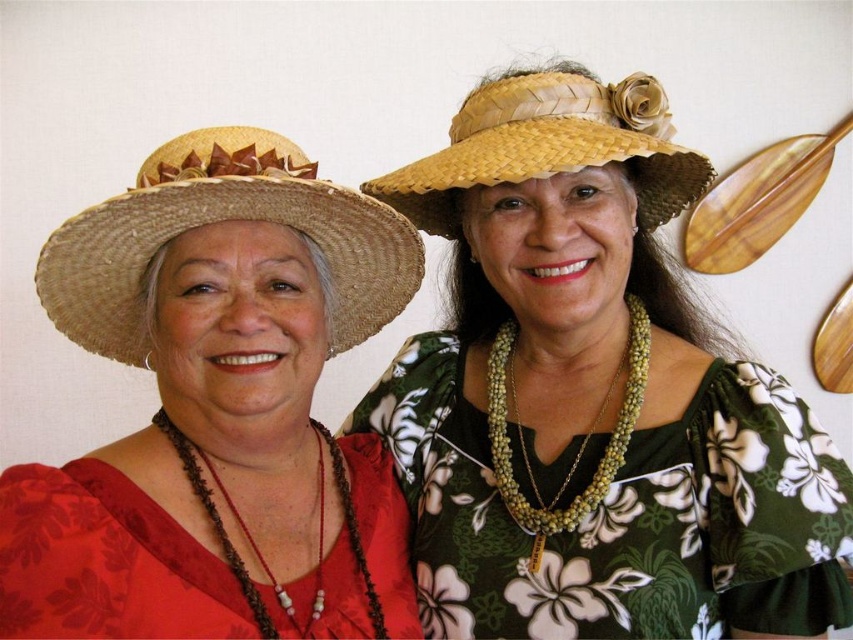
From the picture: You are an artist trying to paint the two women in the scene. You need to decide which hat to paint first based on their positions and sizes. Since the matte straw hat at upper left is taller than the straw woven hat at left, which hat should you start with to ensure proper layering?

The matte straw hat at upper left should be painted first because it has a greater height compared to the straw woven hat at left, so it will be layered over the other elements.

You are an artist sketching the two women in the image. You need to draw their hats accurately. Which hat should you focus on first if you want to start with the one at point (x=593, y=396)?

You should focus on the matte straw hat at upper center first because it is located at point (x=593, y=396).